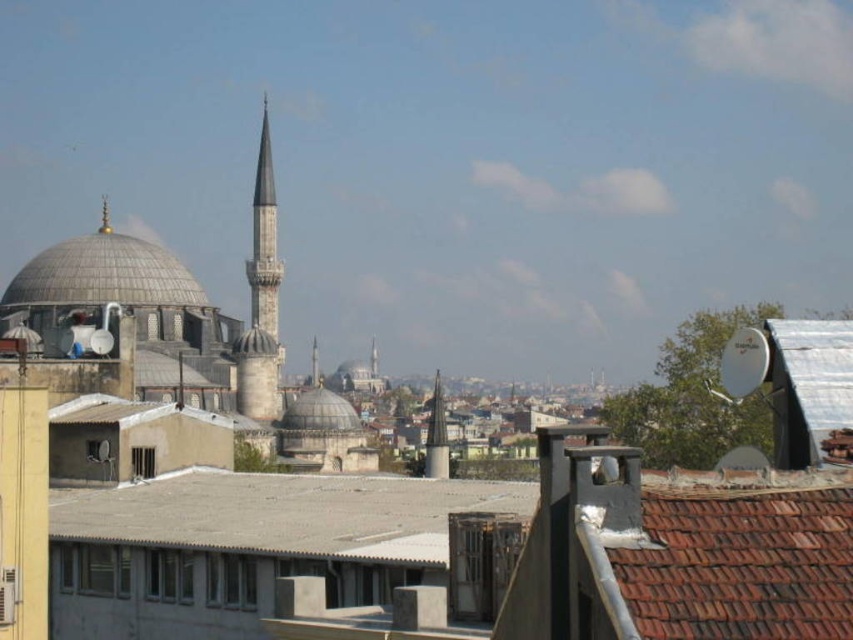
Question: Is brown tile roof at lower right bigger than gray concrete roof at center?

Choices:
 (A) yes
 (B) no

Answer: (B)

Question: In this image, where is gray stone minaret at center located relative to smooth silver spire at center?

Choices:
 (A) left
 (B) right

Answer: (A)

Question: Which point is closer to the camera?

Choices:
 (A) gray stone minaret at center
 (B) smooth silver spire at center
 (C) smooth gray minaret at center
 (D) gray concrete roof at center

Answer: (D)

Question: Among these objects, which one is nearest to the camera?

Choices:
 (A) brown tile roof at lower right
 (B) gray stone minaret at center

Answer: (A)

Question: Which point is farther to the camera?

Choices:
 (A) brown tile roof at lower right
 (B) gray stone minaret at center
 (C) smooth silver spire at center
 (D) gray concrete roof at center

Answer: (C)

Question: Is smooth gray minaret at center to the right of gold polished spire at center from the viewer's perspective?

Choices:
 (A) no
 (B) yes

Answer: (B)